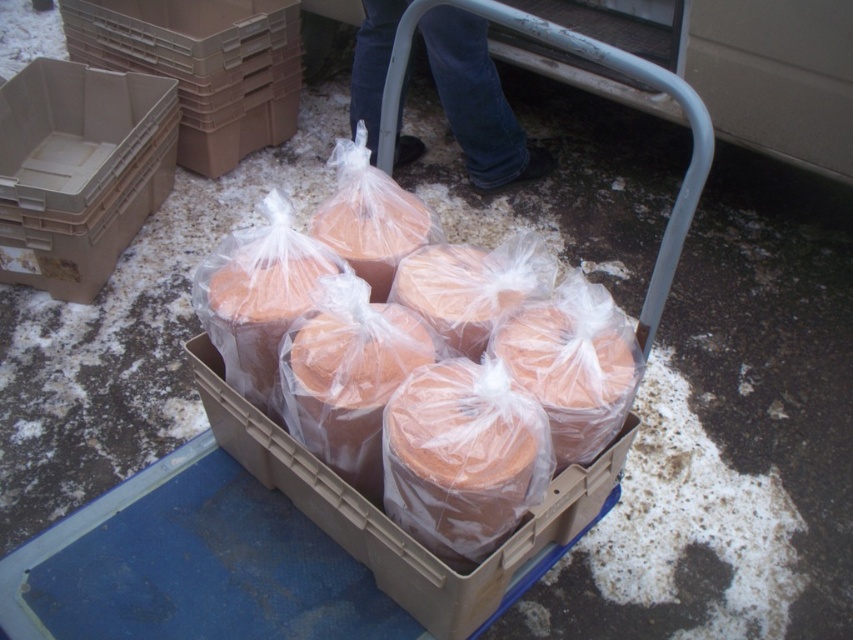
How much distance is there between tan plastic crate at upper left and blue jeans at upper center?

They are 24.34 inches apart.

Which is more to the left, tan plastic crate at upper left or blue jeans at upper center?

tan plastic crate at upper left is more to the left.

What do you see at coordinates (202, 65) in the screenshot? I see `tan plastic crate at upper left` at bounding box center [202, 65].

Find the location of a particular element. tan plastic crate at upper left is located at coordinates (202, 65).

Who is higher up, beige plastic crate at upper left or tan plastic crate at upper left?

tan plastic crate at upper left is above.

Does beige plastic crate at upper left have a greater width compared to tan plastic crate at upper left?

No.

This screenshot has width=853, height=640. Describe the element at coordinates (79, 170) in the screenshot. I see `beige plastic crate at upper left` at that location.

Identify the location of beige plastic crate at upper left. This screenshot has width=853, height=640. (79, 170).

Is translucent plastic containers at center to the left of beige plastic crate at upper left from the viewer's perspective?

In fact, translucent plastic containers at center is to the right of beige plastic crate at upper left.

Who is more forward, [219,296] or [135,109]?

Point [219,296] is more forward.

This screenshot has height=640, width=853. I want to click on translucent plastic containers at center, so click(x=402, y=403).